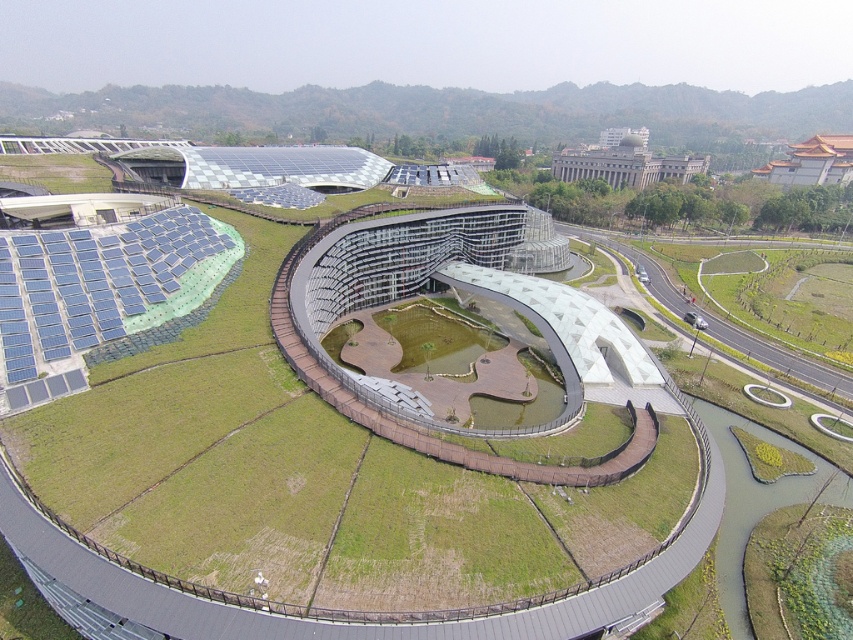
You are standing at the entrance of the architectural complex and want to reach the green grass at center. According to the coordinates provided, in which direction should you move relative to your current position?

A: The green grass at center is located at coordinates point (x=329, y=621), so you should move forward and to the right from your current position at the entrance to reach it.

You are standing in the modern architectural complex and want to take a photo of both the point at coordinates (18, 500) and the point at coordinates (563, 163). Given that you can only focus on one point at a time, which point should you focus on first to ensure the other point remains in focus?

You should focus on point (563, 163) first because it is farther from the viewer than point (18, 500). By focusing on the farther point, the closer point will still be within the depth of field and remain in focus.